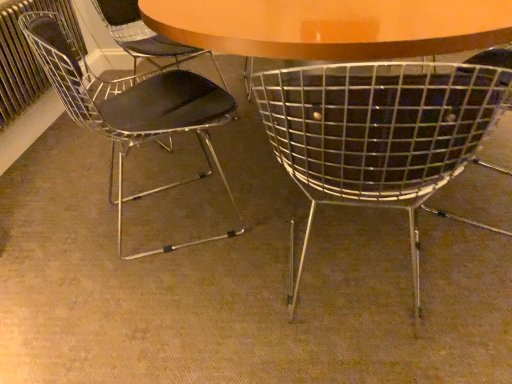
Question: Is metallic wire chair at left, which appears as the 2th chair when viewed from the right, closer to the viewer compared to metallic radiator at left?

Choices:
 (A) yes
 (B) no

Answer: (A)

Question: From a real-world perspective, is metallic wire chair at left, which appears as the 2th chair when viewed from the right, over metallic radiator at left?

Choices:
 (A) yes
 (B) no

Answer: (B)

Question: Is metallic wire chair at left, the 1th chair from the left, at the left side of metallic radiator at left?

Choices:
 (A) no
 (B) yes

Answer: (A)

Question: From a real-world perspective, does metallic wire chair at left, the 1th chair from the left, sit lower than metallic radiator at left?

Choices:
 (A) no
 (B) yes

Answer: (B)

Question: Considering the relative sizes of metallic wire chair at left, the 1th chair from the left, and metallic radiator at left in the image provided, is metallic wire chair at left, the 1th chair from the left, wider than metallic radiator at left?

Choices:
 (A) no
 (B) yes

Answer: (B)

Question: From a real-world perspective, relative to metal mesh chair at center, the first chair when ordered from right to left, is metallic wire chair at left, which appears as the 2th chair when viewed from the right, vertically above or below?

Choices:
 (A) above
 (B) below

Answer: (A)

Question: Does point (130, 127) appear closer or farther from the camera than point (388, 198)?

Choices:
 (A) farther
 (B) closer

Answer: (A)

Question: From the image's perspective, is metallic wire chair at left, the 1th chair from the left, positioned above or below metal mesh chair at center, which is the second chair in left-to-right order?

Choices:
 (A) below
 (B) above

Answer: (B)

Question: Is metallic wire chair at left, which appears as the 2th chair when viewed from the right, wider or thinner than metal mesh chair at center, the first chair when ordered from right to left?

Choices:
 (A) thin
 (B) wide

Answer: (A)

Question: From the image's perspective, relative to metal mesh chair at center, which is the second chair in left-to-right order, is metallic radiator at left above or below?

Choices:
 (A) above
 (B) below

Answer: (A)

Question: Is metallic radiator at left situated inside metal mesh chair at center, the first chair when ordered from right to left, or outside?

Choices:
 (A) inside
 (B) outside

Answer: (B)

Question: Considering the positions of point (34, 59) and point (486, 99), is point (34, 59) closer or farther from the camera than point (486, 99)?

Choices:
 (A) closer
 (B) farther

Answer: (B)

Question: Based on their sizes in the image, would you say metallic radiator at left is bigger or smaller than metal mesh chair at center, the first chair when ordered from right to left?

Choices:
 (A) big
 (B) small

Answer: (B)

Question: From their relative heights in the image, would you say metallic wire chair at left, which appears as the 2th chair when viewed from the right, is taller or shorter than metallic radiator at left?

Choices:
 (A) short
 (B) tall

Answer: (B)

Question: Is metallic wire chair at left, the 1th chair from the left, wider or thinner than metallic radiator at left?

Choices:
 (A) wide
 (B) thin

Answer: (A)